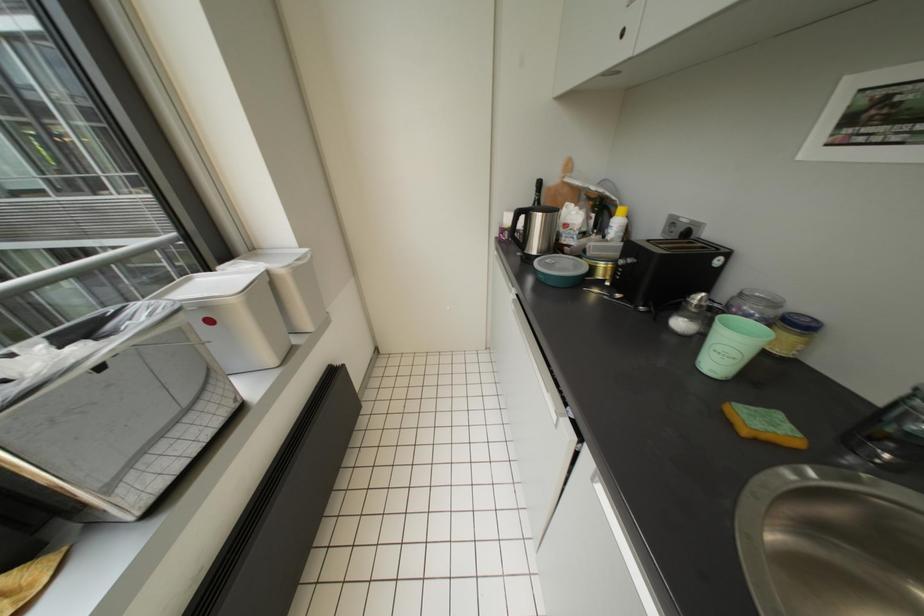
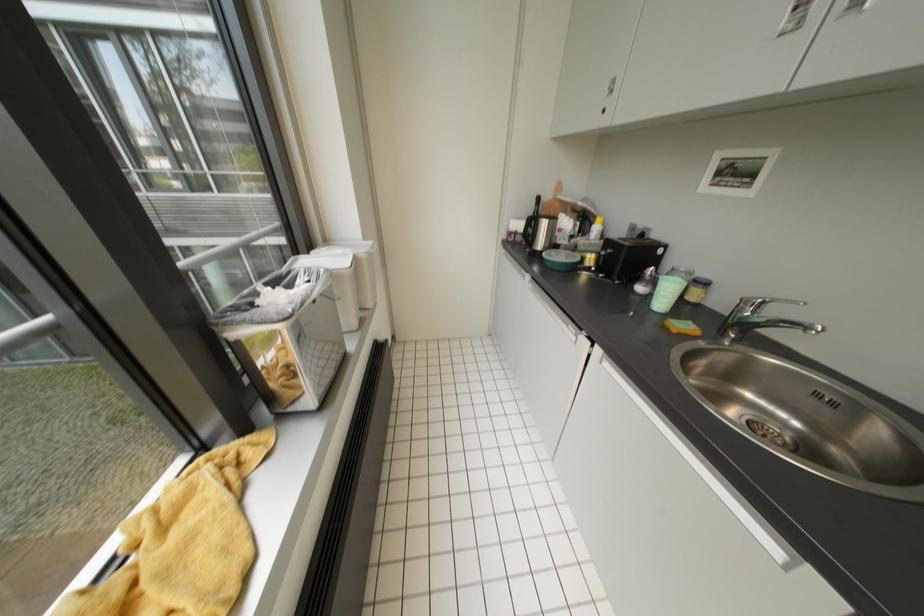
Question: The camera is either moving clockwise (left) or counter-clockwise (right) around the object. The first image is from the beginning of the video and the second image is from the end. Is the camera moving left or right when shooting the video?

Choices:
 (A) Left
 (B) Right

Answer: (A)